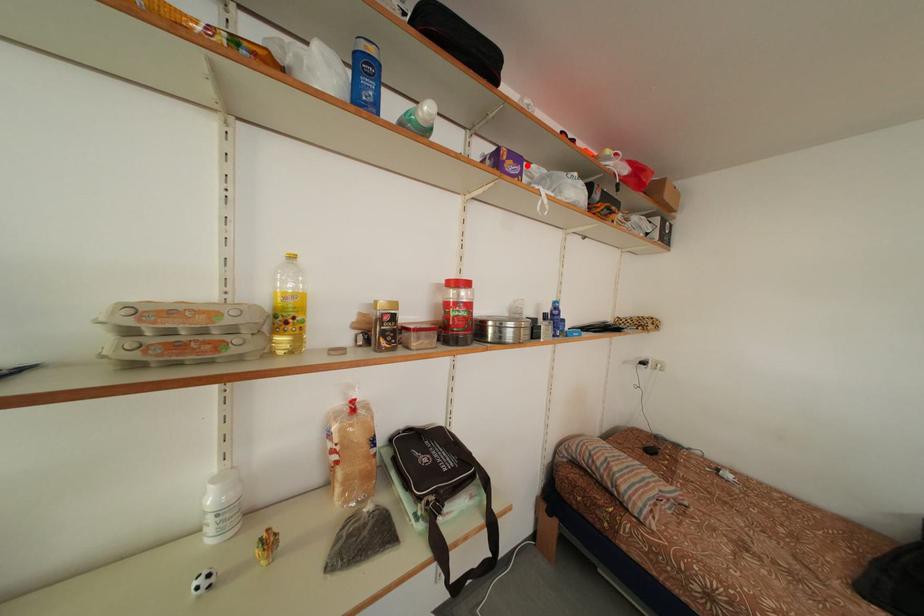
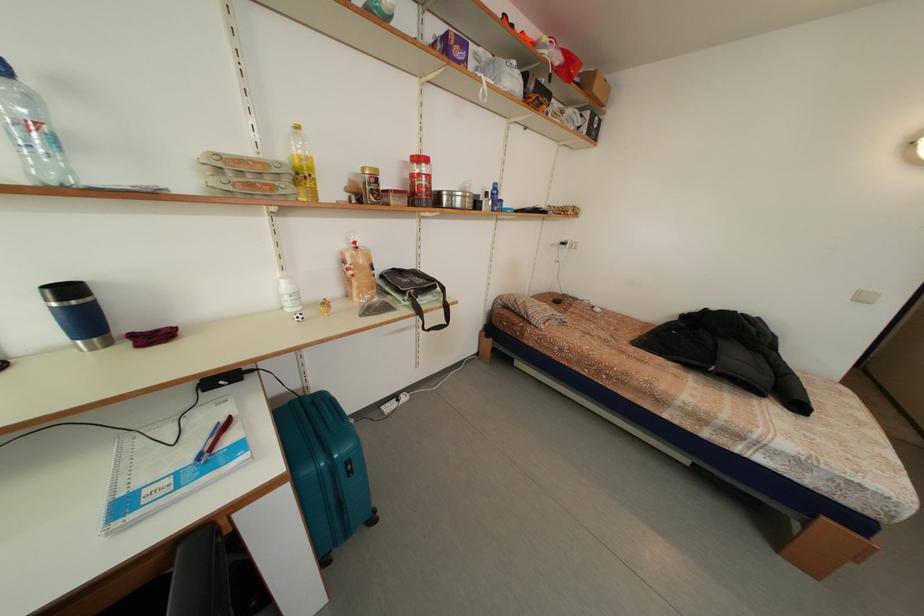
Locate, in the second image, the point that corresponds to the highlighted location in the first image.

(472, 51)